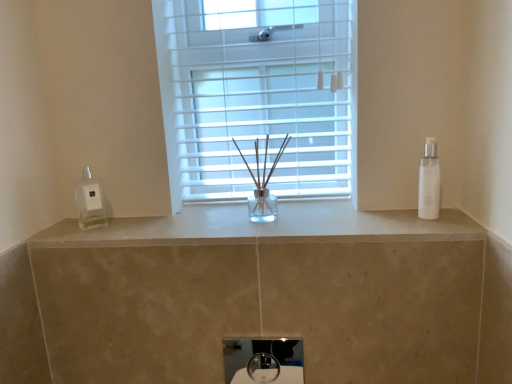
Question: From the image's perspective, is white glossy sink at center located above or below white glossy bottle at right?

Choices:
 (A) below
 (B) above

Answer: (A)

Question: In terms of width, does white glossy sink at center look wider or thinner when compared to white glossy bottle at right?

Choices:
 (A) thin
 (B) wide

Answer: (A)

Question: Considering the real-world distances, which object is farthest from the white glossy sink at center?

Choices:
 (A) white glossy soap dispenser at left
 (B) white glossy bottle at right
 (C) white plastic window at center
 (D) white marble counter at center

Answer: (B)

Question: Which of these objects is positioned closest to the white plastic window at center?

Choices:
 (A) white glossy bottle at right
 (B) white glossy sink at center
 (C) white glossy soap dispenser at left
 (D) white marble counter at center

Answer: (D)